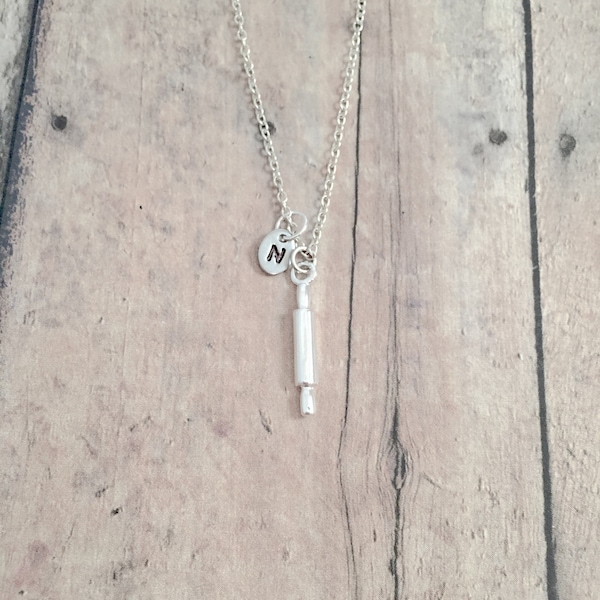
Locate an element on the screen. This screenshot has width=600, height=600. dark circles in wood is located at coordinates (494, 133), (560, 142), (62, 123).